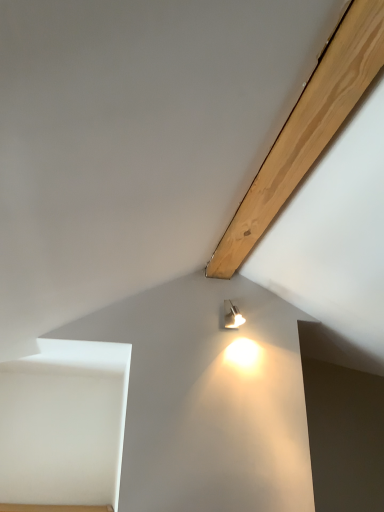
Question: Is there a large distance between natural wood beam at upper right and matte silver lamp at upper right?

Choices:
 (A) no
 (B) yes

Answer: (A)

Question: Does natural wood beam at upper right have a larger size compared to matte silver lamp at upper right?

Choices:
 (A) yes
 (B) no

Answer: (A)

Question: Is natural wood beam at upper right further to the viewer compared to matte silver lamp at upper right?

Choices:
 (A) no
 (B) yes

Answer: (A)

Question: From the image's perspective, is natural wood beam at upper right below matte silver lamp at upper right?

Choices:
 (A) no
 (B) yes

Answer: (A)

Question: Is natural wood beam at upper right positioned in front of matte silver lamp at upper right?

Choices:
 (A) yes
 (B) no

Answer: (A)

Question: Does natural wood beam at upper right have a smaller size compared to matte silver lamp at upper right?

Choices:
 (A) yes
 (B) no

Answer: (B)

Question: Is matte silver lamp at upper right far away from natural wood beam at upper right?

Choices:
 (A) yes
 (B) no

Answer: (B)

Question: Is matte silver lamp at upper right positioned behind natural wood beam at upper right?

Choices:
 (A) no
 (B) yes

Answer: (B)

Question: From a real-world perspective, is matte silver lamp at upper right beneath natural wood beam at upper right?

Choices:
 (A) yes
 (B) no

Answer: (A)

Question: Are matte silver lamp at upper right and natural wood beam at upper right making contact?

Choices:
 (A) no
 (B) yes

Answer: (A)

Question: Does matte silver lamp at upper right have a greater width compared to natural wood beam at upper right?

Choices:
 (A) yes
 (B) no

Answer: (A)

Question: Can you confirm if matte silver lamp at upper right is shorter than natural wood beam at upper right?

Choices:
 (A) yes
 (B) no

Answer: (B)

Question: Considering the positions of natural wood beam at upper right and matte silver lamp at upper right in the image, is natural wood beam at upper right bigger or smaller than matte silver lamp at upper right?

Choices:
 (A) big
 (B) small

Answer: (A)